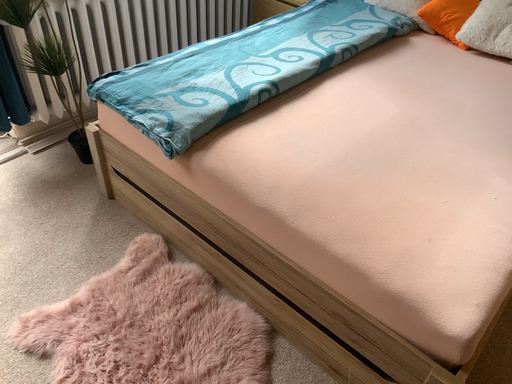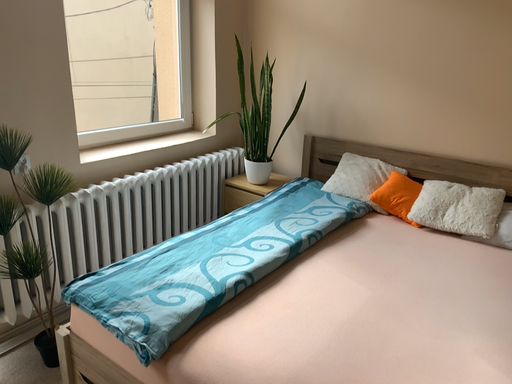
Question: Which way did the camera rotate in the video?

Choices:
 (A) rotated upward
 (B) rotated downward

Answer: (A)